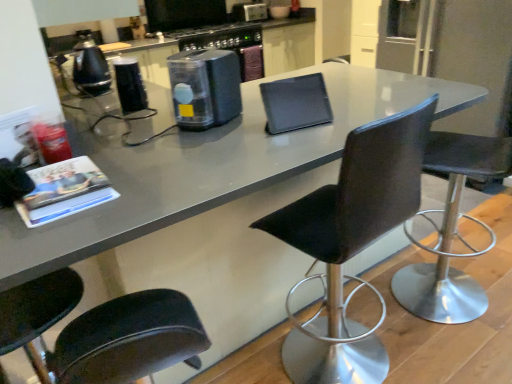
Question: Can you confirm if metallic silver toaster at upper center, placed as the 1th appliance when sorted from top to bottom, is wider than black leather chair at center, acting as the second chair starting from the left?

Choices:
 (A) no
 (B) yes

Answer: (A)

Question: Does metallic silver toaster at upper center, the first appliance in the right-to-left sequence, contain black leather chair at center, the 2th chair positioned from the right?

Choices:
 (A) no
 (B) yes

Answer: (A)

Question: Could you tell me if metallic silver toaster at upper center, placed as the 1th appliance when sorted from top to bottom, is facing black leather chair at center, acting as the second chair starting from the left?

Choices:
 (A) yes
 (B) no

Answer: (B)

Question: Can you confirm if metallic silver toaster at upper center, the 3th appliance positioned from the left, is taller than black leather chair at center, acting as the second chair starting from the left?

Choices:
 (A) no
 (B) yes

Answer: (A)

Question: Does metallic silver toaster at upper center, the 3th appliance positioned from the left, appear on the left side of black leather chair at center, acting as the second chair starting from the left?

Choices:
 (A) yes
 (B) no

Answer: (A)

Question: Is metallic silver toaster at upper center, the third appliance from the bottom, located outside black leather chair at center, acting as the second chair starting from the left?

Choices:
 (A) yes
 (B) no

Answer: (A)

Question: Is black glossy kettle at left, which ranks as the third appliance in right-to-left order, wider than black leather chair at right, the first chair in the right-to-left sequence?

Choices:
 (A) no
 (B) yes

Answer: (A)

Question: From a real-world perspective, is black glossy kettle at left, which is counted as the second appliance, starting from the front, physically below black leather chair at right, the first chair in the right-to-left sequence?

Choices:
 (A) yes
 (B) no

Answer: (B)

Question: Is black glossy kettle at left, which ranks as the third appliance in right-to-left order, behind black leather chair at right, the third chair from the left?

Choices:
 (A) no
 (B) yes

Answer: (B)

Question: Can you see black glossy kettle at left, the first appliance viewed from the left, touching black leather chair at right, the first chair in the right-to-left sequence?

Choices:
 (A) yes
 (B) no

Answer: (B)

Question: Is black glossy kettle at left, the second appliance positioned from the bottom, positioned far away from black leather chair at right, the first chair in the right-to-left sequence?

Choices:
 (A) yes
 (B) no

Answer: (A)

Question: Does black glossy kettle at left, which is counted as the second appliance, starting from the front, come in front of black leather chair at right, the third chair from the left?

Choices:
 (A) no
 (B) yes

Answer: (A)

Question: Is transparent plastic container at center, marked as the 3th appliance in a top-to-bottom arrangement, looking in the opposite direction of metallic silver toaster at upper center, placed as the 1th appliance when sorted from top to bottom?

Choices:
 (A) no
 (B) yes

Answer: (A)